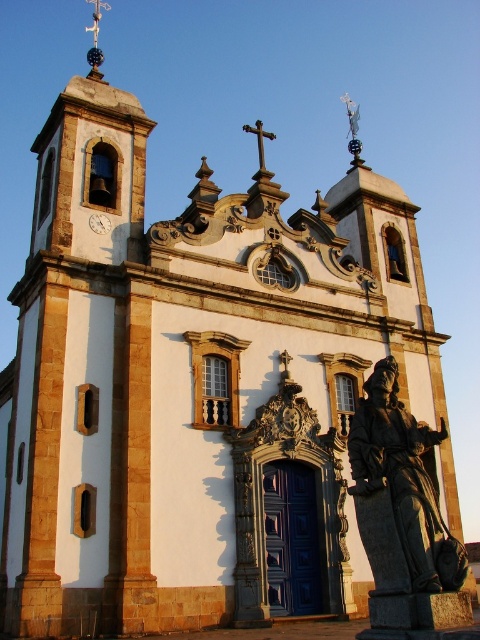
You are standing in front of the church and notice two items at the center of the facade. The bronze statue at center and the metallic clock at center. Which one is positioned to the right of the other?

The bronze statue at center is to the right of the metallic clock at center.

You are standing in front of the church and notice two points marked on the facade. The first point is at coordinate point (393, 576) and the second is at point (93, 227). Which point is closer to you?

Point (393, 576) is in front of point (93, 227), so the first point is closer to you.

You are an architect visiting the church and want to place a new decorative element between the bronze statue at center and the metallic clock at center. Considering their sizes, which object should the new element be placed closer to?

The bronze statue at center is larger than the metallic clock at center, so the new decorative element should be placed closer to the metallic clock at center to maintain balance.